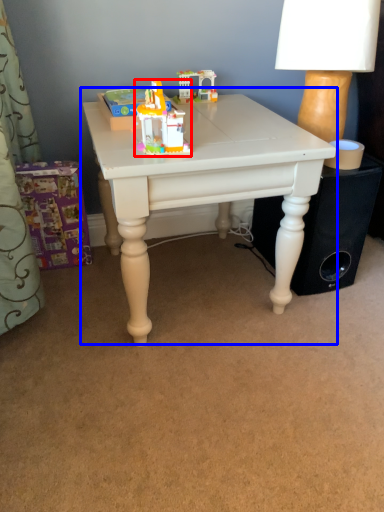
Question: Among these objects, which one is farthest to the camera, toy (highlighted by a red box) or table (highlighted by a blue box)?

Choices:
 (A) toy
 (B) table

Answer: (B)